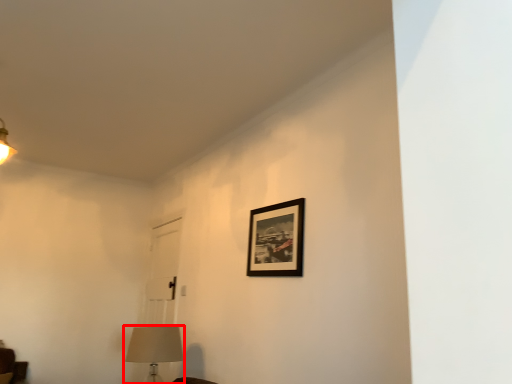
Question: From the image, what is the correct spatial relationship of table lamp (annotated by the red box) in relation to picture frame?

Choices:
 (A) right
 (B) left

Answer: (B)